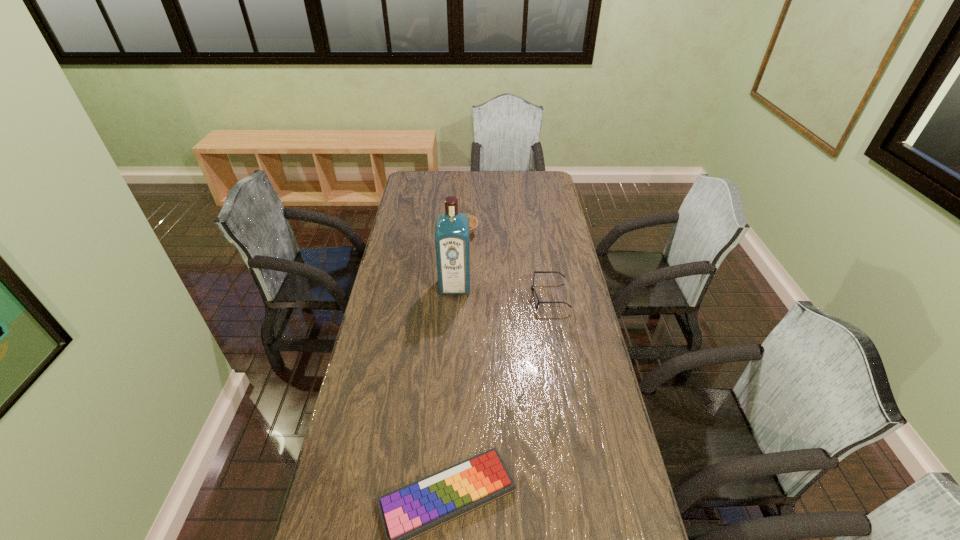
You are a GUI agent. You are given a task and a screenshot of the screen. Output one action in this format:
    pyautogui.click(x=<x>, y=<y>)
    Task: Click on the liquor
    Image resolution: width=960 pixels, height=540 pixels.
    Given the screenshot: What is the action you would take?
    pyautogui.click(x=452, y=229)

Where is `the farthest object`? the farthest object is located at coordinates (473, 221).

Locate an element on the screen. The image size is (960, 540). the rightmost object is located at coordinates (532, 287).

Image resolution: width=960 pixels, height=540 pixels. What are the coordinates of `free spot located on the flat label side of the tallest object` in the screenshot? It's located at (451, 352).

The width and height of the screenshot is (960, 540). Identify the location of free region located 0.220m on the front of the farthest object. (462, 274).

Identify the location of free space located 0.340m on the front-facing side of the rightmost object. (441, 296).

The image size is (960, 540). In order to click on free space located on the front-facing side of the rightmost object in this screenshot , I will do `click(472, 296)`.

Identify the location of free location located 0.320m on the front-facing side of the rightmost object. (445, 296).

Find the location of a particular element. object located in the right edge section of the desktop is located at coordinates (532, 287).

Find the location of a particular element. This screenshot has height=540, width=960. free space at the far edge is located at coordinates (498, 176).